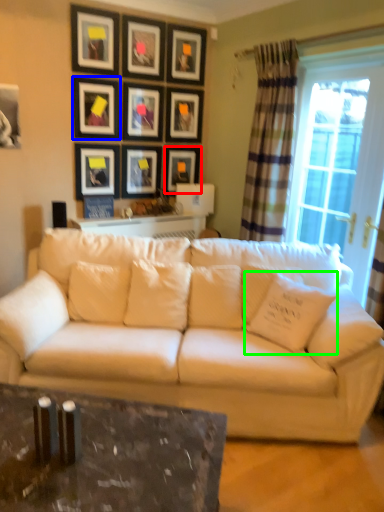
Question: Which is nearer to the picture frame (highlighted by a red box)? picture frame (highlighted by a blue box) or pillow (highlighted by a green box).

Choices:
 (A) picture frame
 (B) pillow

Answer: (A)